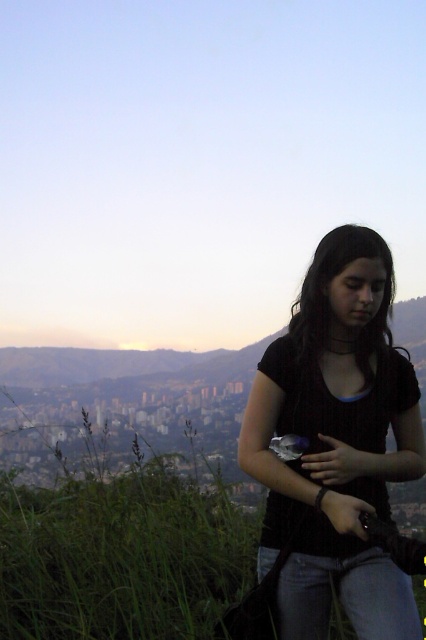
Question: Can you confirm if black knitted sweater at center is positioned to the left of blue denim jeans at lower right?

Choices:
 (A) no
 (B) yes

Answer: (A)

Question: Which point appears closest to the camera in this image?

Choices:
 (A) (383, 602)
 (B) (365, 230)

Answer: (A)

Question: Does black knitted sweater at center appear on the right side of blue denim jeans at lower right?

Choices:
 (A) no
 (B) yes

Answer: (B)

Question: Is black knitted sweater at center to the right of blue denim jeans at lower right from the viewer's perspective?

Choices:
 (A) no
 (B) yes

Answer: (B)

Question: Which object is closer to the camera taking this photo?

Choices:
 (A) green grass at lower left
 (B) black knitted sweater at center

Answer: (B)

Question: Which point appears closest to the camera in this image?

Choices:
 (A) (382, 289)
 (B) (298, 621)
 (C) (166, 474)

Answer: (B)